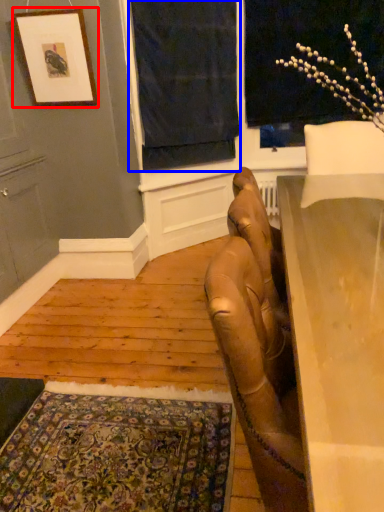
Question: Which point is further to the camera, picture frame (highlighted by a red box) or curtain (highlighted by a blue box)?

Choices:
 (A) picture frame
 (B) curtain

Answer: (B)